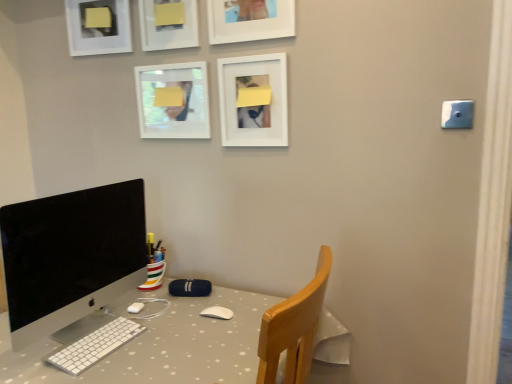
The height and width of the screenshot is (384, 512). Find the location of `vacant area that lies to the right of white plastic keyboard at lower left`. vacant area that lies to the right of white plastic keyboard at lower left is located at coordinates (182, 342).